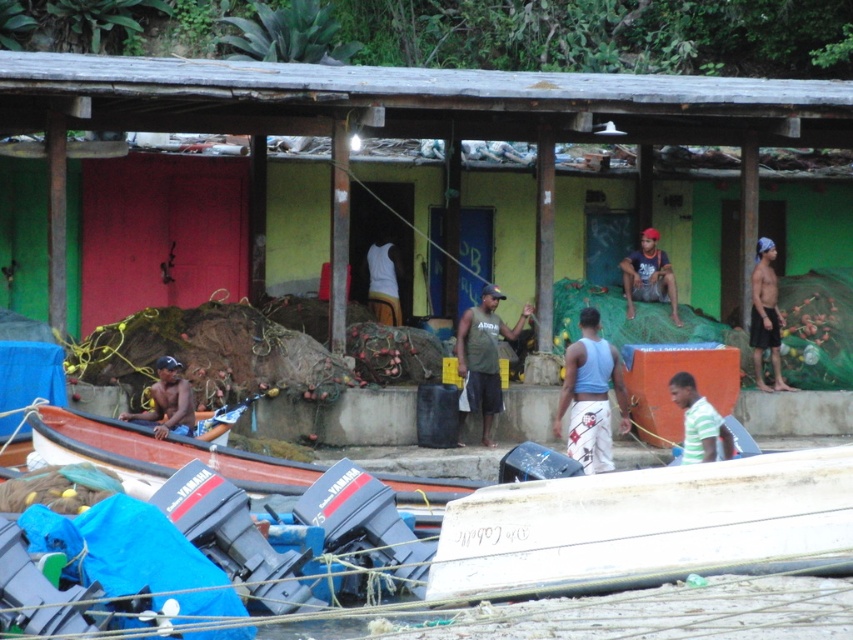
You are a visitor to this fishing village and want to take a photo of the brown wooden canoe at lower left and the green striped shirt at lower right. Since you want both in the frame, will you need to zoom in or zoom out your camera?

The brown wooden canoe at lower left is larger in size than the green striped shirt at lower right. To include both in the frame without cropping either, you would need to zoom out to accommodate the larger size of the brown wooden canoe at lower left.

What are the coordinates of the light blue tank top at center?

The light blue tank top at center is located at point (590, 396).

You are a photographer trying to capture a clear shot of both the light blue tank top at center and the white matte tank top at center. Since you want both to be visible, which one should you focus on first to ensure the background doesn t blur out the other?

You should focus on the light blue tank top at center first because it is taller than the white matte tank top at center, so focusing on the taller one will help keep both in focus without one being overly blurred.